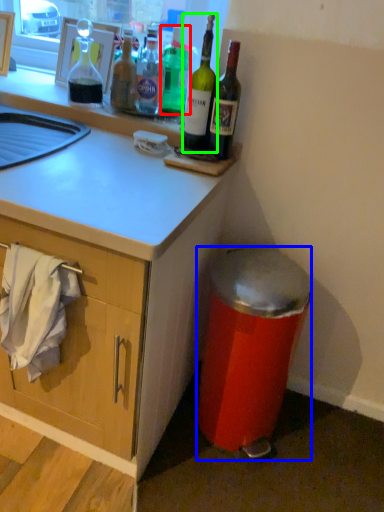
Question: Considering the real-world distances, which object is farthest from bottle (highlighted by a red box)? trash bin/can (highlighted by a blue box) or bottle (highlighted by a green box)?

Choices:
 (A) trash bin/can
 (B) bottle

Answer: (A)